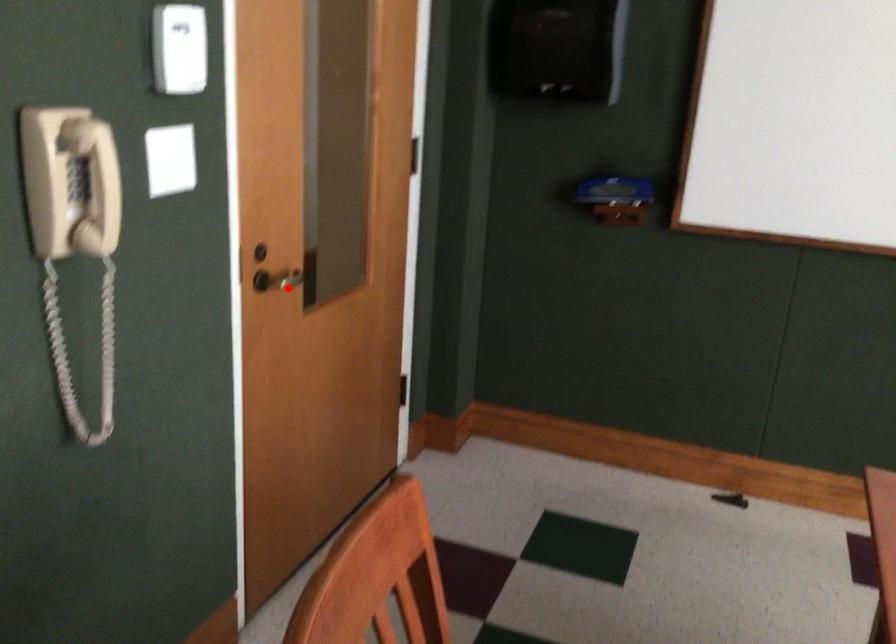
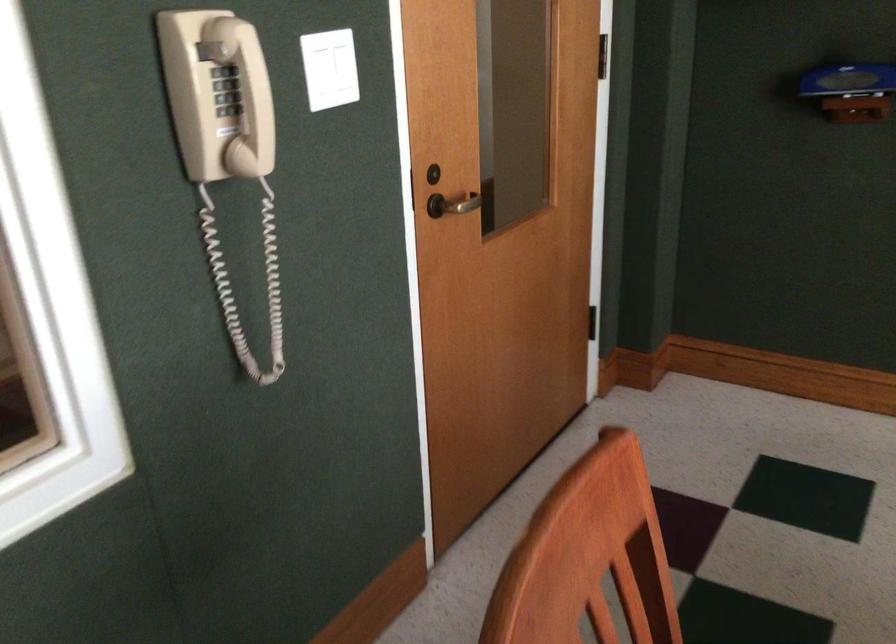
Question: I am providing you with two images of the same scene from different viewpoints. In image1, a red point is highlighted. Considering the same 3D point in image2, which of the following is correct?

Choices:
 (A) It is closer
 (B) It is farther

Answer: (A)